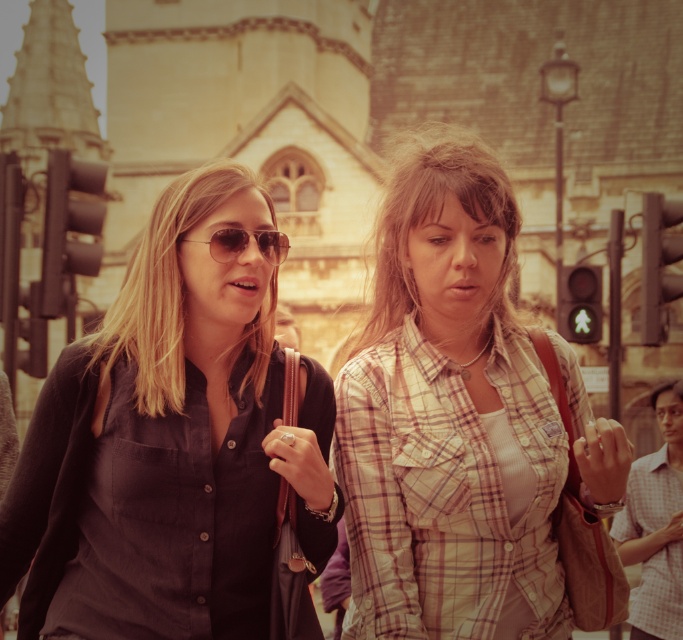
You are a photographer trying to capture a closeup shot of the plaid cotton shirt at center and the matte aviator sunglasses at center. Which object should you zoom in more on to ensure both are in focus?

You should zoom in more on the plaid cotton shirt at center because it is larger in size than the matte aviator sunglasses at center, so adjusting focus to accommodate its size will help both objects remain in focus.

You are standing at the point with coordinates point (404, 202) and want to walk towards the historic building in the background. Is the point point (507, 198) blocking your path?

Point (507, 198) is in front of point (404, 202), so it would block your path if you are walking towards the historic building in the background.